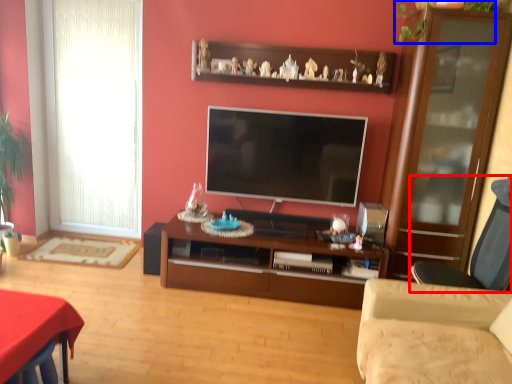
Question: Which of the following is the farthest to the observer, chair (highlighted by a red box) or plant (highlighted by a blue box)?

Choices:
 (A) chair
 (B) plant

Answer: (B)